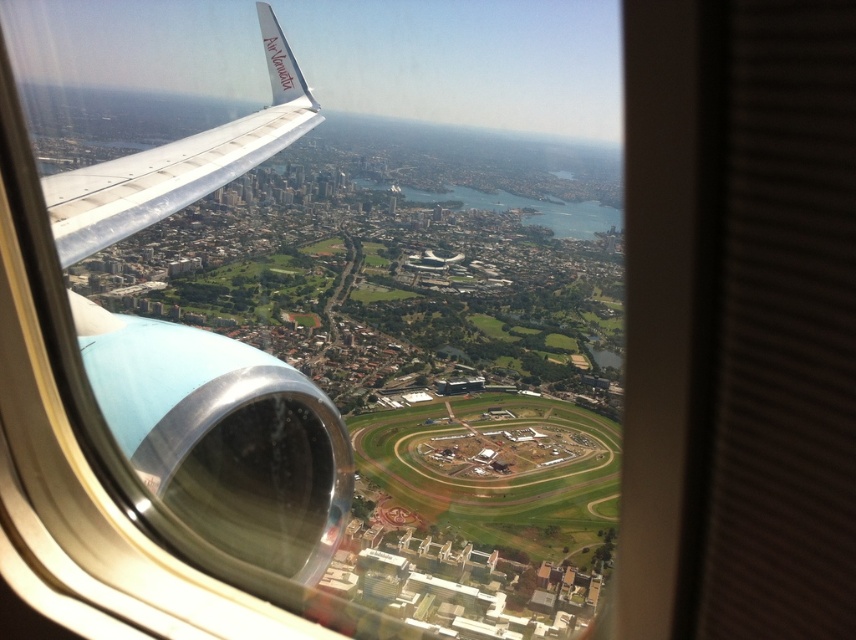
Question: Is metallic silver wing at left positioned at the back of white matte wing at upper left?

Choices:
 (A) no
 (B) yes

Answer: (B)

Question: Does metallic silver wing at left have a smaller size compared to white matte wing at upper left?

Choices:
 (A) no
 (B) yes

Answer: (A)

Question: Does metallic silver wing at left lie in front of white matte wing at upper left?

Choices:
 (A) no
 (B) yes

Answer: (A)

Question: Which point is farther from the camera taking this photo?

Choices:
 (A) (91, 232)
 (B) (287, 401)

Answer: (B)

Question: Which object is farther from the camera taking this photo?

Choices:
 (A) white matte wing at upper left
 (B) metallic silver wing at left

Answer: (B)

Question: Which object is closer to the camera taking this photo?

Choices:
 (A) white matte wing at upper left
 (B) metallic silver wing at left

Answer: (A)